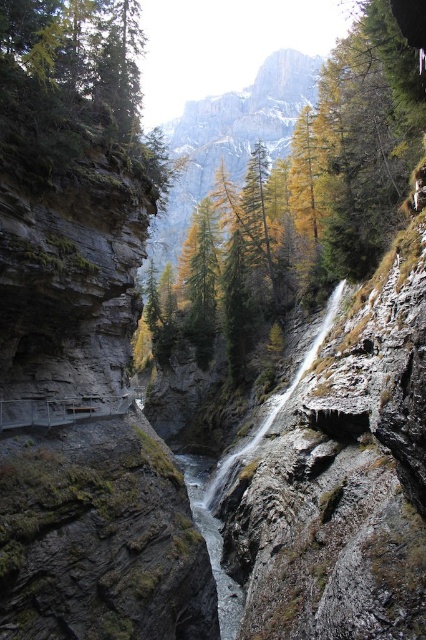
Question: Does golden larch trees at upper center have a greater width compared to clear water at center?

Choices:
 (A) yes
 (B) no

Answer: (A)

Question: Is golden larch trees at upper center below clear water at center?

Choices:
 (A) yes
 (B) no

Answer: (B)

Question: Is golden larch trees at upper center positioned before clear water at center?

Choices:
 (A) yes
 (B) no

Answer: (B)

Question: Among these points, which one is nearest to the camera?

Choices:
 (A) (195, 502)
 (B) (169, 124)

Answer: (A)

Question: Among these objects, which one is farthest from the camera?

Choices:
 (A) clear water at center
 (B) golden larch trees at upper center

Answer: (B)

Question: Which point is closer to the camera?

Choices:
 (A) golden larch trees at upper center
 (B) clear water at center

Answer: (B)